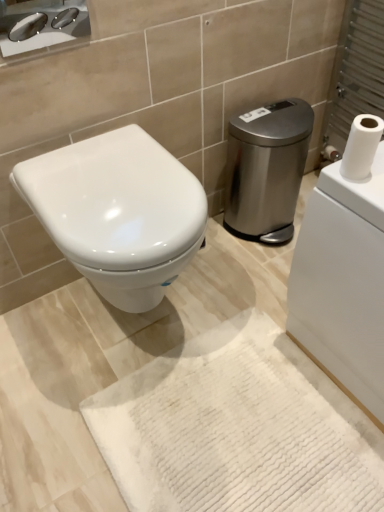
Question: From the image's perspective, is white textured bath mat at center located above or below white glossy toilet at center?

Choices:
 (A) above
 (B) below

Answer: (B)

Question: Is white textured bath mat at center in front of or behind white glossy toilet at center in the image?

Choices:
 (A) behind
 (B) front

Answer: (B)

Question: Which object is the farthest from the satin silver trash can at center right?

Choices:
 (A) polished chrome sink at upper left
 (B) white matte toilet paper at upper right
 (C) white glossy toilet at center
 (D) white textured bath mat at center

Answer: (A)

Question: Estimate the real-world distances between objects in this image. Which object is closer to the white matte toilet paper at upper right?

Choices:
 (A) white textured bath mat at center
 (B) polished chrome sink at upper left
 (C) satin silver trash can at center right
 (D) white glossy toilet at center

Answer: (D)